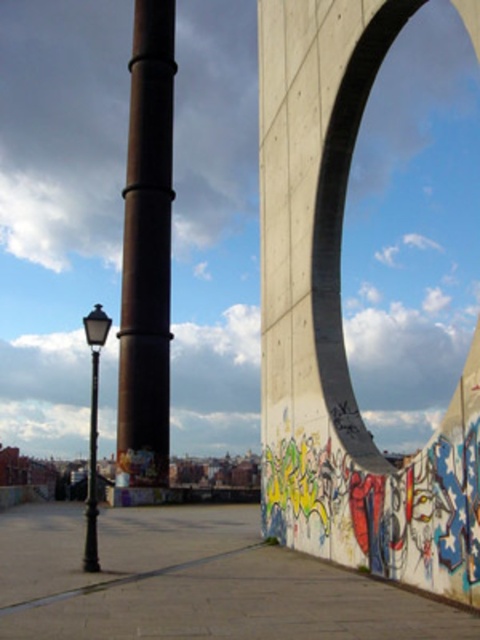
Question: Estimate the real-world distances between objects in this image. Which object is closer to the polished brass streetlamp at lower left?

Choices:
 (A) rusty metal pole at center
 (B) concrete/rough wall at center

Answer: (B)

Question: Based on their relative distances, which object is nearer to the rusty metal pole at center?

Choices:
 (A) concrete/rough wall at center
 (B) polished brass streetlamp at lower left

Answer: (B)

Question: Considering the real-world distances, which object is farthest from the polished brass streetlamp at lower left?

Choices:
 (A) concrete/rough wall at center
 (B) rusty metal pole at center

Answer: (B)

Question: Can you confirm if rusty metal pole at center is positioned to the right of polished brass streetlamp at lower left?

Choices:
 (A) no
 (B) yes

Answer: (B)

Question: Is concrete/rough wall at center positioned behind polished brass streetlamp at lower left?

Choices:
 (A) no
 (B) yes

Answer: (A)

Question: Observing the image, what is the correct spatial positioning of concrete/rough wall at center in reference to polished brass streetlamp at lower left?

Choices:
 (A) left
 (B) right

Answer: (B)